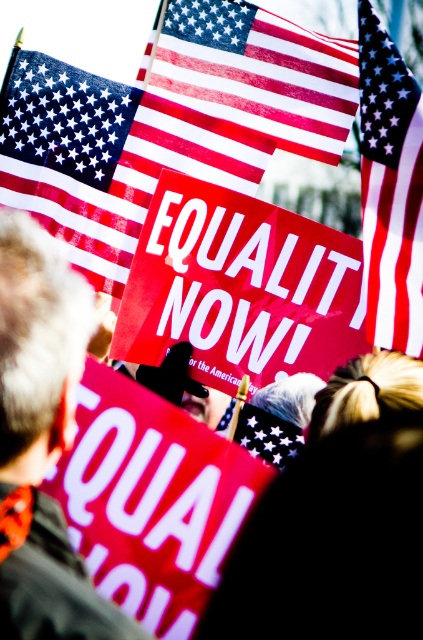
Question: Among these points, which one is farthest from the camera?

Choices:
 (A) (43, 168)
 (B) (90, 321)
 (C) (264, 35)

Answer: (C)

Question: Is the position of matte red flag at upper center more distant than that of matte fabric flag at upper right?

Choices:
 (A) no
 (B) yes

Answer: (B)

Question: Does gray hair at upper left appear on the left side of matte fabric flag at upper right?

Choices:
 (A) yes
 (B) no

Answer: (A)

Question: Which object appears closest to the camera in this image?

Choices:
 (A) matte fabric flag at upper right
 (B) gray hair at upper left
 (C) red-white-striped flag at upper center
 (D) matte red flag at upper center

Answer: (B)

Question: Which object is farther from the camera taking this photo?

Choices:
 (A) matte red flag at upper center
 (B) matte fabric flag at upper right

Answer: (A)

Question: Is gray hair at upper left above matte fabric flag at upper right?

Choices:
 (A) no
 (B) yes

Answer: (A)